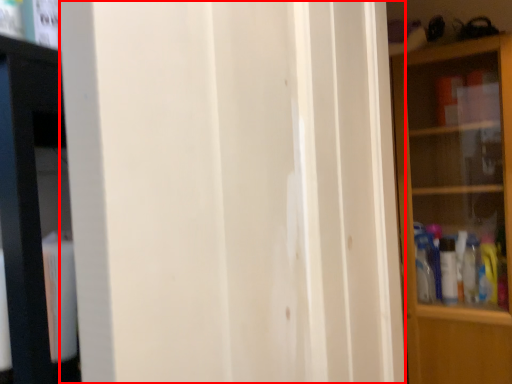
Question: From the image, what is the correct spatial relationship of screen door (annotated by the red box) in relation to shelf?

Choices:
 (A) right
 (B) left

Answer: (B)